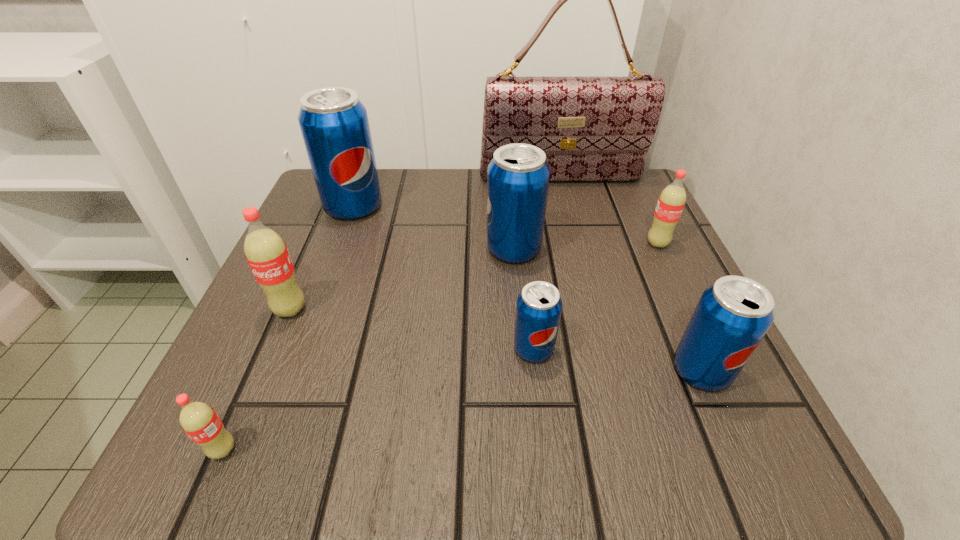
Select which red soda appears as the closest to the farthest blue pop soda. Please provide its 2D coordinates. Your answer should be formatted as a tuple, i.e. [(x, y)], where the tuple contains the x and y coordinates of a point satisfying the conditions above.

[(266, 252)]

Locate which red soda is the third closest to the second smallest blue pop soda. Please provide its 2D coordinates. Your answer should be formatted as a tuple, i.e. [(x, y)], where the tuple contains the x and y coordinates of a point satisfying the conditions above.

[(198, 420)]

This screenshot has width=960, height=540. Identify the location of free location that satisfies the following two spatial constraints: 1. on the back side of the third smallest blue pop soda; 2. on the right side of the fifth farthest object. (316, 249).

Image resolution: width=960 pixels, height=540 pixels. I want to click on blank space that satisfies the following two spatial constraints: 1. on the front side of the rightmost blue pop soda; 2. on the left side of the farthest soda, so click(293, 370).